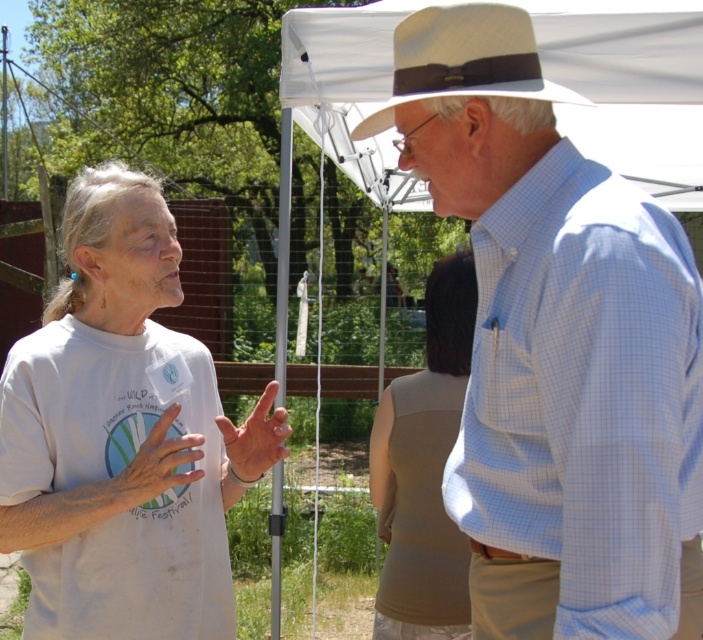
Question: Is white cotton t-shirt at left above white fabric canopy at upper center?

Choices:
 (A) no
 (B) yes

Answer: (A)

Question: Is white cotton t-shirt at left bigger than beige fabric tank top at center?

Choices:
 (A) yes
 (B) no

Answer: (A)

Question: Which of the following is the farthest from the observer?

Choices:
 (A) beige fabric tank top at center
 (B) beige straw hat at upper center

Answer: (A)

Question: Which of the following is the farthest from the observer?

Choices:
 (A) (621, 582)
 (B) (212, 403)
 (C) (295, 49)
 (D) (444, 538)

Answer: (C)

Question: Observing the image, what is the correct spatial positioning of white fabric canopy at upper center in reference to beige straw hat at upper center?

Choices:
 (A) left
 (B) right

Answer: (B)

Question: Which is farther from the white cotton t-shirt at left?

Choices:
 (A) light blue checkered shirt at center
 (B) white fabric canopy at upper center

Answer: (B)